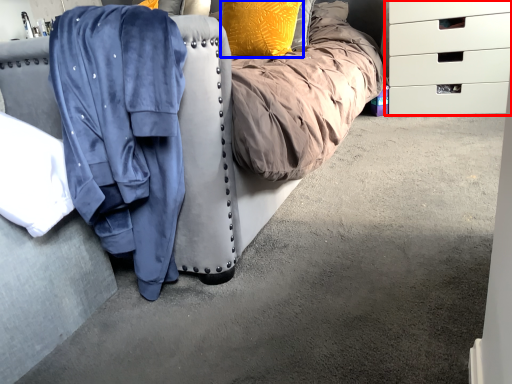
Question: Which point is further to the camera, chest of drawers (highlighted by a red box) or pillow (highlighted by a blue box)?

Choices:
 (A) chest of drawers
 (B) pillow

Answer: (A)